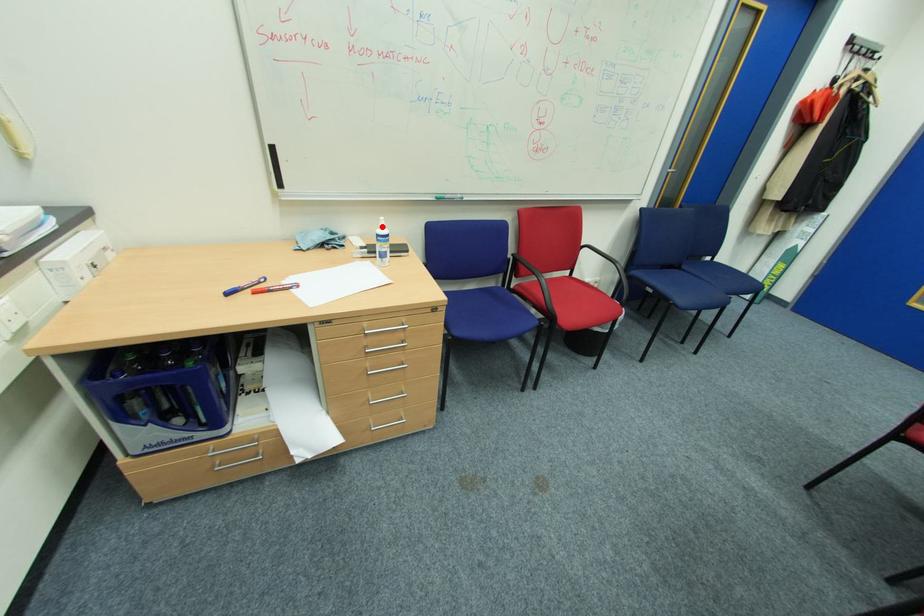
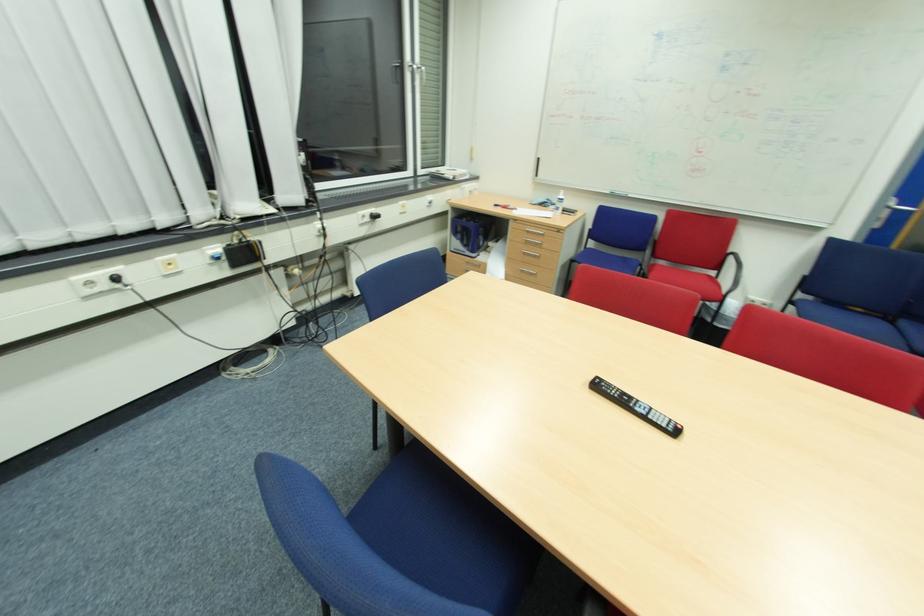
Where in the second image is the point corresponding to the highlighted location from the first image?

(564, 195)